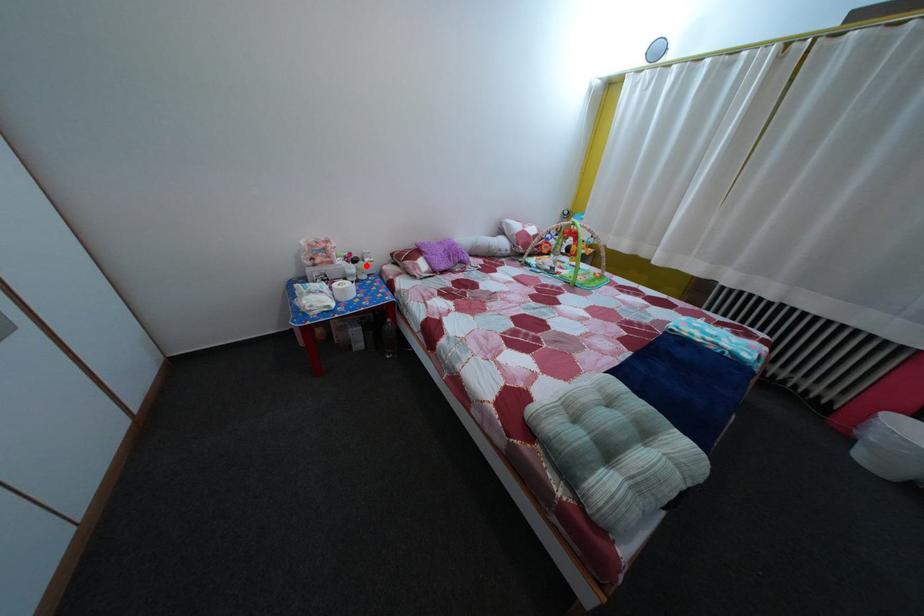
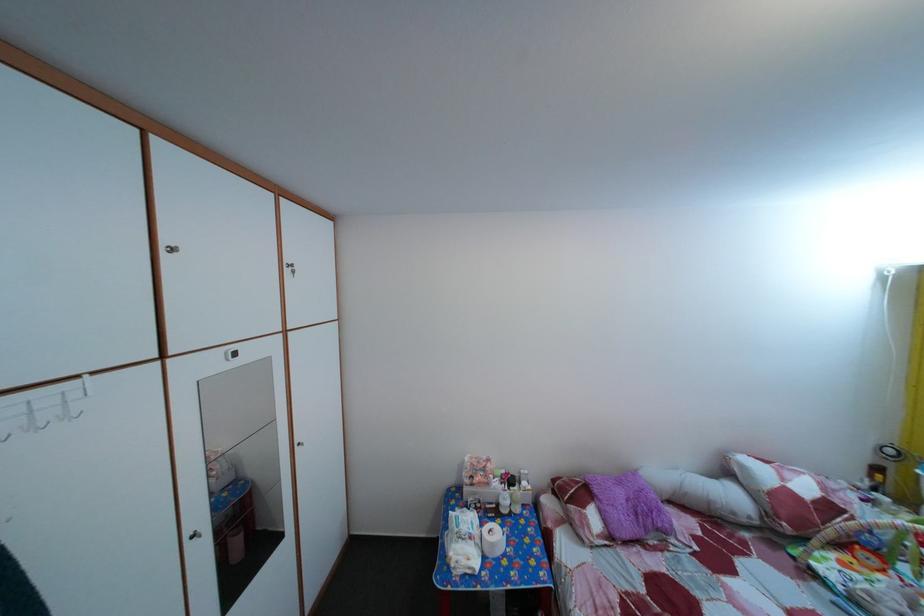
The point at the highlighted location is marked in the first image. Where is the corresponding point in the second image?

(524, 485)